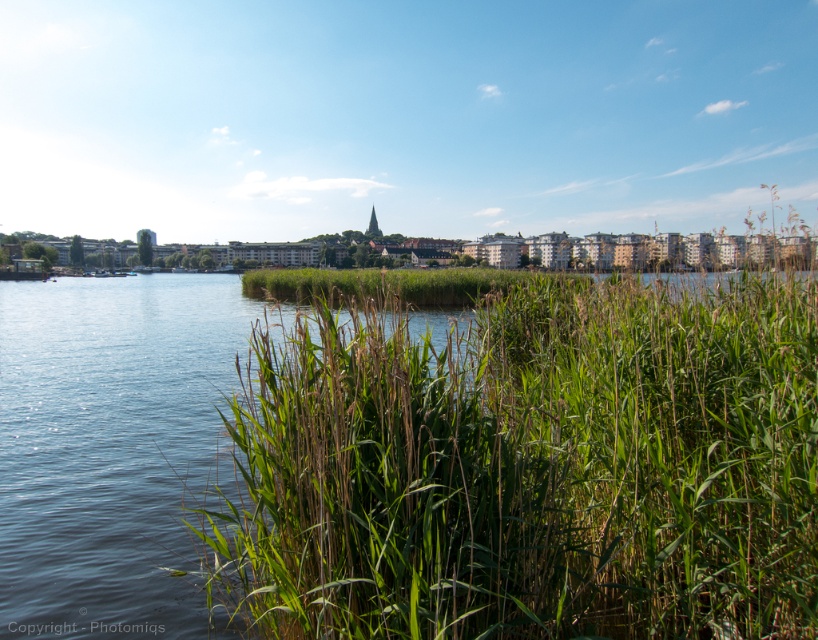
You are standing at the lakeside and want to reach a specific point marked as point (x=598, y=337). If you can walk 120 feet in 5 minutes, will you be able to reach it within that time?

Point (x=598, y=337) is 119.66 feet away from the camera. Since you can walk 120 feet in 5 minutes, you can reach it within the time.

You are standing at the edge of the lakeside and notice the green leafy grass at center. If you want to walk directly towards it from your current position, which direction should you move relative to the lake?

The green leafy grass at center is located at point (528, 468), so you should move towards the center of the lake to reach it.

You are a landscape architect designing a new park. You have to decide where to place a small wooden bench. The bench must be placed closer to the green leafy grass at center than to the green grassy river at center. Based on the scene description, where should you position the bench?

The bench should be placed closer to the green leafy grass at center than to the green grassy river at center. Since the green leafy grass at center occupies less space than the green grassy river at center, positioning the bench near the smaller area ensures it is closer to the grass.